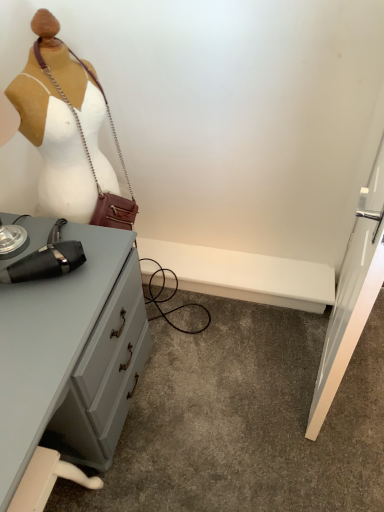
Question: Can you see matte black hairdryer at left touching matte gray desk at left?

Choices:
 (A) no
 (B) yes

Answer: (A)

Question: Is matte black hairdryer at left smaller than matte gray desk at left?

Choices:
 (A) no
 (B) yes

Answer: (B)

Question: From the image's perspective, would you say matte black hairdryer at left is shown under matte gray desk at left?

Choices:
 (A) no
 (B) yes

Answer: (A)

Question: Considering the relative sizes of matte black hairdryer at left and matte gray desk at left in the image provided, is matte black hairdryer at left shorter than matte gray desk at left?

Choices:
 (A) no
 (B) yes

Answer: (A)

Question: Is matte black hairdryer at left surrounding matte gray desk at left?

Choices:
 (A) no
 (B) yes

Answer: (A)

Question: From the image's perspective, is matte black hairdryer at left on top of matte gray desk at left?

Choices:
 (A) yes
 (B) no

Answer: (A)

Question: From a real-world perspective, is matte gray desk at left beneath matte black hairdryer at left?

Choices:
 (A) no
 (B) yes

Answer: (B)

Question: Can you confirm if matte gray desk at left is positioned to the right of matte black hairdryer at left?

Choices:
 (A) yes
 (B) no

Answer: (B)

Question: From a real-world perspective, is matte gray desk at left physically above matte black hairdryer at left?

Choices:
 (A) yes
 (B) no

Answer: (B)

Question: Is matte gray desk at left placed right next to matte black hairdryer at left?

Choices:
 (A) yes
 (B) no

Answer: (B)

Question: Is matte gray desk at left facing towards matte black hairdryer at left?

Choices:
 (A) yes
 (B) no

Answer: (B)

Question: Could matte black hairdryer at left be considered to be inside matte gray desk at left?

Choices:
 (A) yes
 (B) no

Answer: (B)

Question: Considering the positions of matte gray desk at left and matte black hairdryer at left in the image, is matte gray desk at left wider or thinner than matte black hairdryer at left?

Choices:
 (A) wide
 (B) thin

Answer: (A)